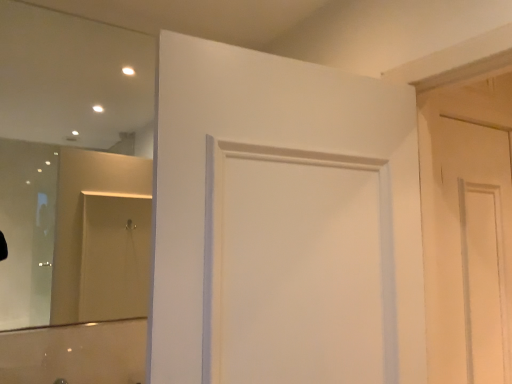
Question: Can you confirm if white matte door at right, placed as the first door when sorted from right to left, is wider than clear glass mirror at upper left?

Choices:
 (A) yes
 (B) no

Answer: (B)

Question: Is white matte door at right, the 2th door positioned from the left, to the left of clear glass mirror at upper left from the viewer's perspective?

Choices:
 (A) yes
 (B) no

Answer: (B)

Question: Can you confirm if white matte door at right, placed as the first door when sorted from right to left, is thinner than clear glass mirror at upper left?

Choices:
 (A) no
 (B) yes

Answer: (B)

Question: Does white matte door at right, the second door from the front, have a smaller size compared to clear glass mirror at upper left?

Choices:
 (A) no
 (B) yes

Answer: (B)

Question: Does white matte door at right, placed as the first door when sorted from right to left, contain clear glass mirror at upper left?

Choices:
 (A) yes
 (B) no

Answer: (B)

Question: From a real-world perspective, does white matte door at right, placed as the first door when sorted from back to front, sit lower than clear glass mirror at upper left?

Choices:
 (A) no
 (B) yes

Answer: (B)

Question: Can you confirm if white matte door at center, the first door viewed from the left, is smaller than white matte door at right, the second door from the front?

Choices:
 (A) yes
 (B) no

Answer: (B)

Question: Considering the relative sizes of white matte door at center, which ranks as the second door in back-to-front order, and white matte door at right, the second door from the front, in the image provided, is white matte door at center, which ranks as the second door in back-to-front order, bigger than white matte door at right, the second door from the front,?

Choices:
 (A) yes
 (B) no

Answer: (A)

Question: Considering the relative sizes of white matte door at center, the 2th door positioned from the right, and white matte door at right, the second door from the front, in the image provided, is white matte door at center, the 2th door positioned from the right, thinner than white matte door at right, the second door from the front,?

Choices:
 (A) no
 (B) yes

Answer: (A)

Question: Can you confirm if white matte door at center, the 2th door positioned from the right, is positioned to the left of white matte door at right, the 2th door positioned from the left?

Choices:
 (A) no
 (B) yes

Answer: (B)

Question: Is the position of white matte door at center, acting as the 1th door starting from the front, more distant than that of white matte door at right, the 2th door positioned from the left?

Choices:
 (A) no
 (B) yes

Answer: (A)

Question: Considering the relative sizes of white matte door at center, the first door viewed from the left, and white matte door at right, placed as the first door when sorted from back to front, in the image provided, is white matte door at center, the first door viewed from the left, taller than white matte door at right, placed as the first door when sorted from back to front,?

Choices:
 (A) yes
 (B) no

Answer: (B)

Question: From a real-world perspective, is white matte door at center, acting as the 1th door starting from the front, physically above clear glass mirror at upper left?

Choices:
 (A) yes
 (B) no

Answer: (B)